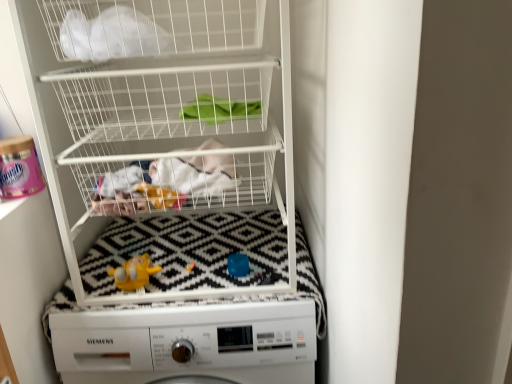
Question: Is white matte washing machine at center situated inside yellow rubber duck at center or outside?

Choices:
 (A) inside
 (B) outside

Answer: (B)

Question: From a real-world perspective, is white matte washing machine at center above or below yellow rubber duck at center?

Choices:
 (A) above
 (B) below

Answer: (B)

Question: Which of these objects is positioned farthest from the white mesh bag at upper left?

Choices:
 (A) white fabric at center
 (B) yellow rubber duck at center
 (C) white matte washing machine at center
 (D) white wire basket at upper center

Answer: (C)

Question: Which of these objects is positioned closest to the white wire basket at upper center?

Choices:
 (A) yellow rubber duck at center
 (B) white mesh bag at upper left
 (C) white matte washing machine at center
 (D) white fabric at center

Answer: (C)